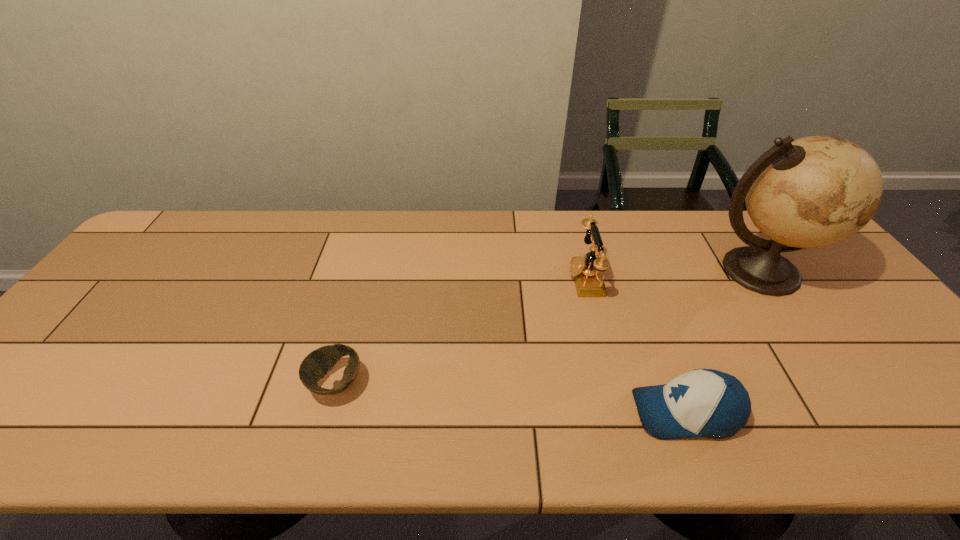
Where is `free space located on the front-facing side of the third tallest object`? The height and width of the screenshot is (540, 960). free space located on the front-facing side of the third tallest object is located at coordinates (589, 413).

You are a GUI agent. You are given a task and a screenshot of the screen. Output one action in this format:
    pyautogui.click(x=<x>, y=<y>)
    Task: Click on the vacant space situated on the front-facing side of the third tallest object
    The height and width of the screenshot is (540, 960).
    Given the screenshot: What is the action you would take?
    pyautogui.click(x=558, y=413)

Find the location of a particular element. The image size is (960, 540). vacant space positioned on the front-facing side of the third tallest object is located at coordinates tap(492, 413).

Where is `vacant space located on the left of the leftmost object`? The height and width of the screenshot is (540, 960). vacant space located on the left of the leftmost object is located at coordinates (168, 383).

Locate an element on the screen. The width and height of the screenshot is (960, 540). globe present at the far edge is located at coordinates (815, 191).

Identify the location of telephone present at the far edge. (586, 271).

This screenshot has width=960, height=540. I want to click on object that is at the near edge, so pos(709,403).

Find the location of `object present at the right edge`. object present at the right edge is located at coordinates (815, 191).

Identify the location of object at the far right corner. Image resolution: width=960 pixels, height=540 pixels. (815, 191).

Where is `vacant space at the far edge`? vacant space at the far edge is located at coordinates (532, 237).